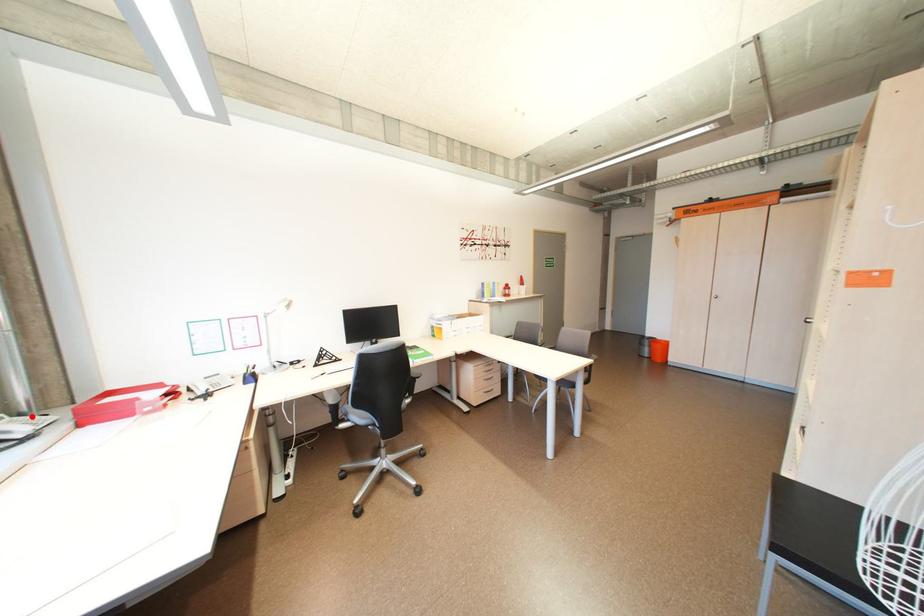
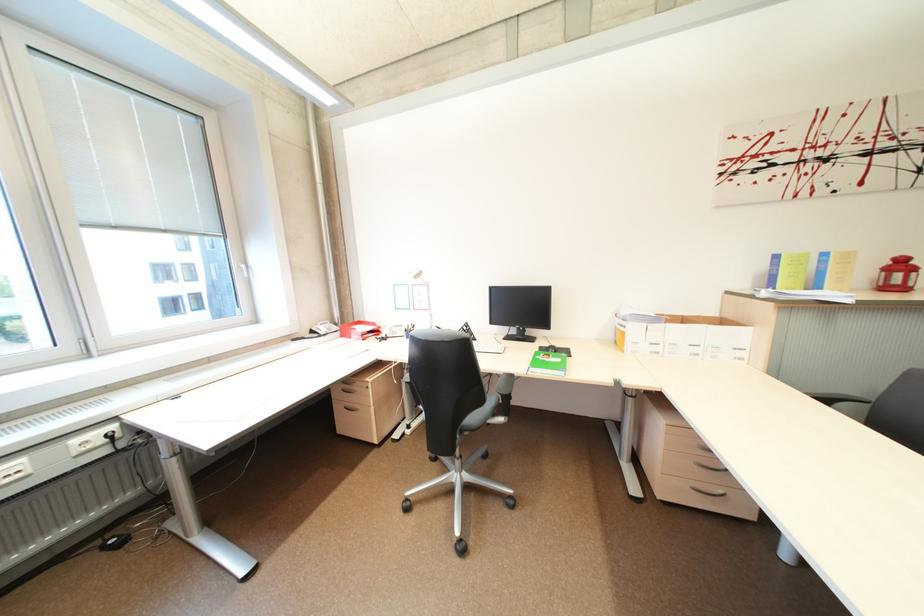
Where in the second image is the point corresponding to the highlighted location from the first image?

(345, 325)